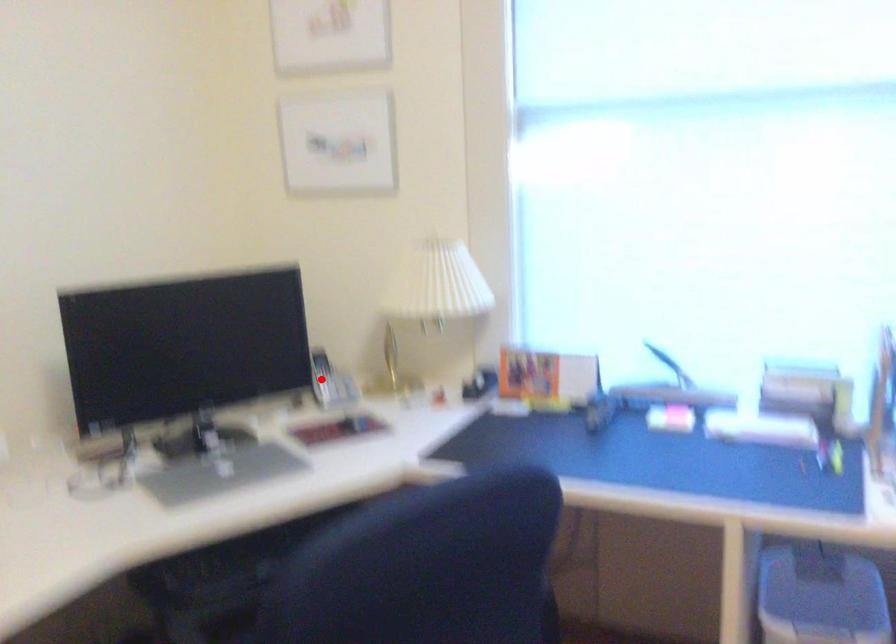
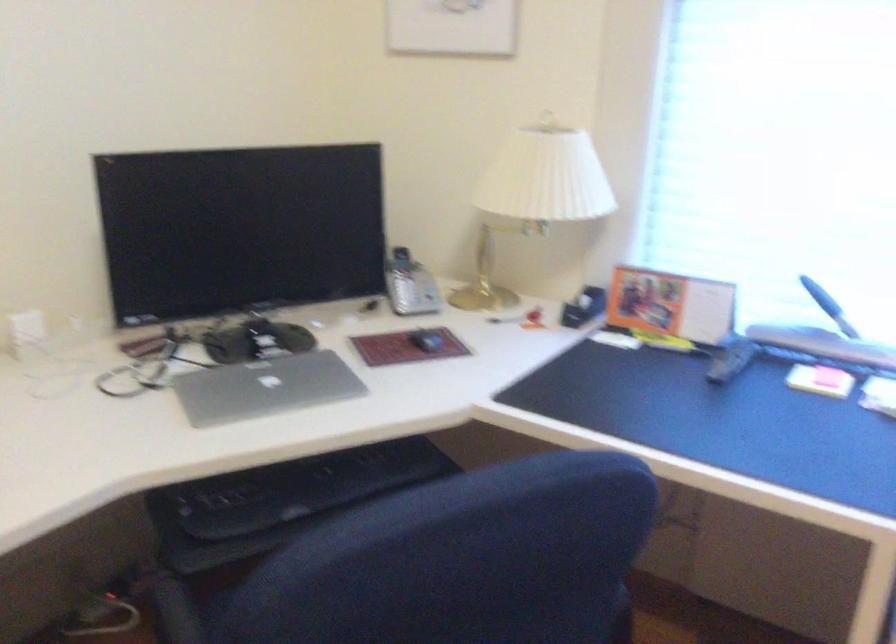
Question: I am providing you with two images of the same scene from different viewpoints. A red point is shown in image1. For the corresponding object point in image2, is it positioned nearer or farther from the camera?

Choices:
 (A) Nearer
 (B) Farther

Answer: (A)